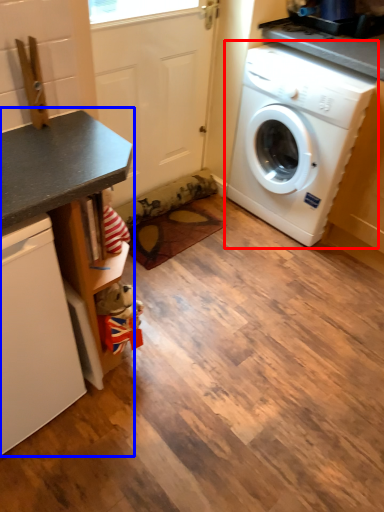
Question: Which object is closer to the camera taking this photo, washing machine (highlighted by a red box) or counter (highlighted by a blue box)?

Choices:
 (A) washing machine
 (B) counter

Answer: (B)